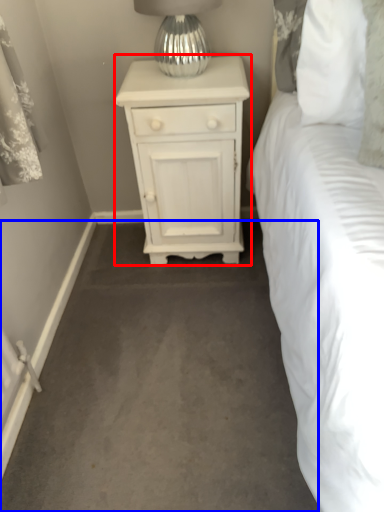
Question: Which object is further to the camera taking this photo, nightstand (highlighted by a red box) or concrete (highlighted by a blue box)?

Choices:
 (A) nightstand
 (B) concrete

Answer: (A)